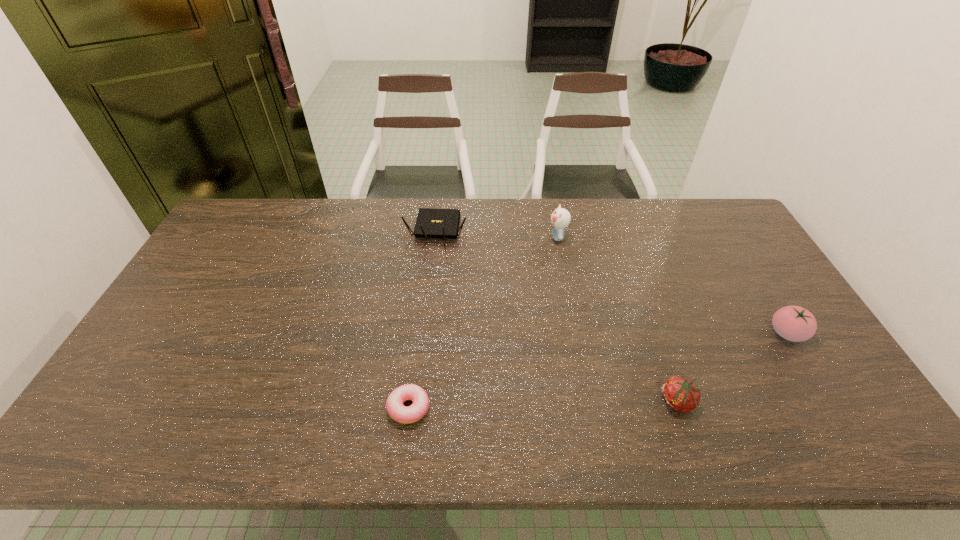
This screenshot has height=540, width=960. In order to click on kitten in this screenshot , I will do `click(560, 218)`.

What are the coordinates of `the tallest object` in the screenshot? It's located at [x=560, y=218].

Locate an element on the screen. The width and height of the screenshot is (960, 540). router is located at coordinates (431, 223).

Image resolution: width=960 pixels, height=540 pixels. What are the coordinates of `the third nearest object` in the screenshot? It's located at (793, 323).

The width and height of the screenshot is (960, 540). Identify the location of the right tomato. (793, 323).

Image resolution: width=960 pixels, height=540 pixels. What are the coordinates of `the fourth tallest object` in the screenshot? It's located at (680, 394).

This screenshot has width=960, height=540. I want to click on the left tomato, so click(x=680, y=394).

Locate an element on the screen. doughnut is located at coordinates click(x=397, y=411).

The width and height of the screenshot is (960, 540). Find the location of `blank space located on the front-facing side of the third object from right to left`. blank space located on the front-facing side of the third object from right to left is located at coordinates (466, 237).

Locate an element on the screen. vacant point located on the front-facing side of the third object from right to left is located at coordinates (504, 237).